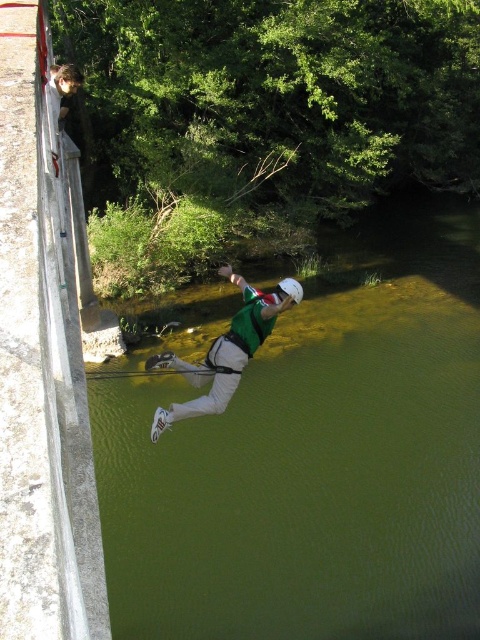
Question: Which point is closer to the camera?

Choices:
 (A) (205, 364)
 (B) (323, 333)

Answer: (A)

Question: Which point is closer to the camera?

Choices:
 (A) green fabric person at center
 (B) green smooth water at center

Answer: (A)

Question: Is green smooth water at center smaller than green fabric person at center?

Choices:
 (A) yes
 (B) no

Answer: (B)

Question: Can you confirm if green smooth water at center is positioned to the right of green fabric person at center?

Choices:
 (A) yes
 (B) no

Answer: (A)

Question: Is green smooth water at center closer to camera compared to green fabric person at center?

Choices:
 (A) no
 (B) yes

Answer: (A)